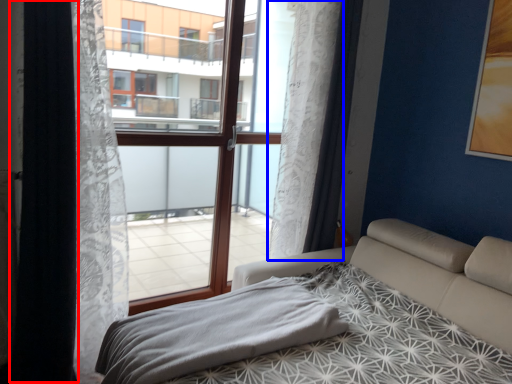
Question: Which point is further to the camera, curtain (highlighted by a red box) or curtain (highlighted by a blue box)?

Choices:
 (A) curtain
 (B) curtain

Answer: (B)